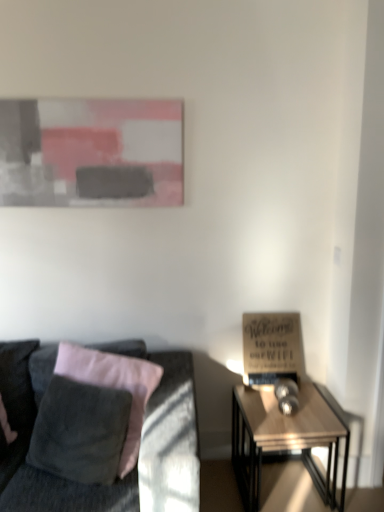
Question: Is velvet gray couch at left at the left side of wooden glossy table at right?

Choices:
 (A) no
 (B) yes

Answer: (B)

Question: From a real-world perspective, is velvet gray couch at left positioned under wooden glossy table at right based on gravity?

Choices:
 (A) yes
 (B) no

Answer: (B)

Question: Can you confirm if velvet gray couch at left is thinner than wooden glossy table at right?

Choices:
 (A) yes
 (B) no

Answer: (B)

Question: Does velvet gray couch at left turn towards wooden glossy table at right?

Choices:
 (A) no
 (B) yes

Answer: (A)

Question: From the image's perspective, does velvet gray couch at left appear higher than wooden glossy table at right?

Choices:
 (A) no
 (B) yes

Answer: (B)

Question: Do you think matte gray painting at upper center is within wooden sign at right, or outside of it?

Choices:
 (A) inside
 (B) outside

Answer: (B)

Question: Considering their positions, is matte gray painting at upper center located in front of or behind wooden sign at right?

Choices:
 (A) front
 (B) behind

Answer: (A)

Question: Is point (91, 155) closer or farther from the camera than point (256, 371)?

Choices:
 (A) farther
 (B) closer

Answer: (B)

Question: Is matte gray painting at upper center bigger or smaller than wooden sign at right?

Choices:
 (A) small
 (B) big

Answer: (B)

Question: In terms of width, does wooden glossy table at right look wider or thinner when compared to matte gray painting at upper center?

Choices:
 (A) thin
 (B) wide

Answer: (B)

Question: From a real-world perspective, is wooden glossy table at right physically located above or below matte gray painting at upper center?

Choices:
 (A) below
 (B) above

Answer: (A)

Question: From the image's perspective, is wooden glossy table at right above or below matte gray painting at upper center?

Choices:
 (A) above
 (B) below

Answer: (B)

Question: Is wooden glossy table at right spatially inside matte gray painting at upper center, or outside of it?

Choices:
 (A) outside
 (B) inside

Answer: (A)

Question: Considering their positions, is wooden sign at right located in front of or behind velvet gray couch at left?

Choices:
 (A) behind
 (B) front

Answer: (A)

Question: In terms of size, does wooden sign at right appear bigger or smaller than velvet gray couch at left?

Choices:
 (A) big
 (B) small

Answer: (B)